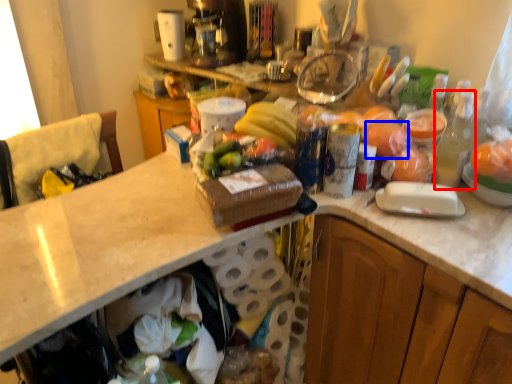
Question: Which point is further to the camera, bottle (highlighted by a red box) or food (highlighted by a blue box)?

Choices:
 (A) bottle
 (B) food

Answer: (B)